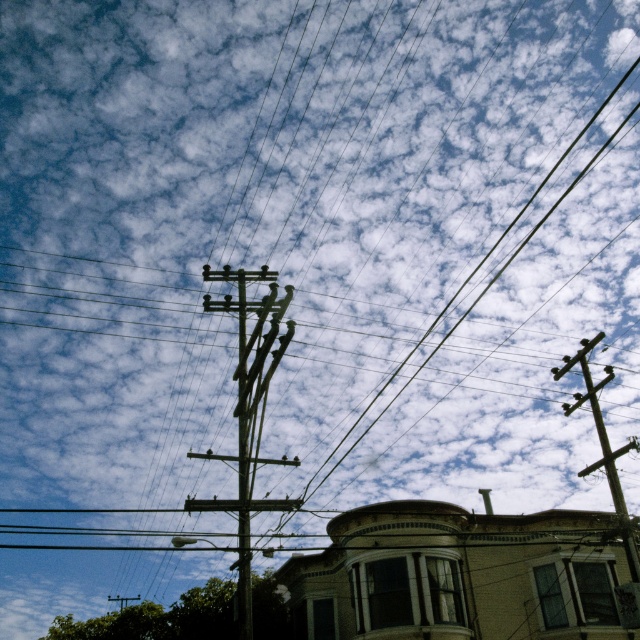
You are standing at the point marked as point (248, 412). Which object is exactly at your current location?

The wooden telephone pole at center is exactly at point (248, 412).

You are a painter setting up your easel to paint the scene. You want to focus on the wooden telephone pole at center and the brown wooden telegraph pole at upper right. Which pole should you position your easel closer to if you want to capture both poles in your painting without cropping either?

You should position your easel closer to the brown wooden telegraph pole at upper right because the wooden telephone pole at center is located above it, meaning the lower position of the brown wooden telegraph pole at upper right allows both poles to be included in the painting without cropping.